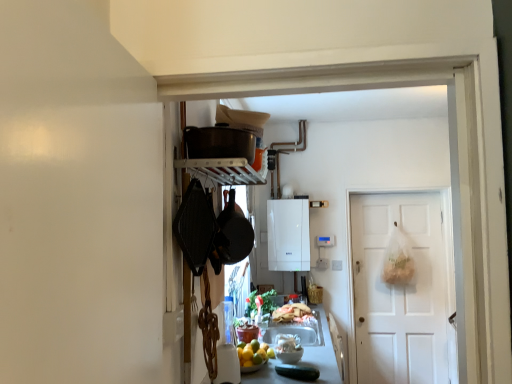
Locate an element on the screen. The height and width of the screenshot is (384, 512). smooth gray countertop at center is located at coordinates (312, 346).

In order to face smooth gray countertop at center, should I rotate leftwards or rightwards?

It's best to rotate right around 5.178 degrees.

Describe the element at coordinates (233, 233) in the screenshot. I see `black matte wok at center` at that location.

Find the location of a particular element. white matte door at center is located at coordinates (402, 291).

This screenshot has height=384, width=512. Describe the element at coordinates (288, 235) in the screenshot. I see `white glossy boiler at center, which is the first appliance in back-to-front order` at that location.

Where is `matte black pot at upper center, acting as the second appliance starting from the back`? This screenshot has height=384, width=512. matte black pot at upper center, acting as the second appliance starting from the back is located at coordinates pyautogui.click(x=219, y=142).

Between matte black pot at upper center, which appears as the first appliance when viewed from the top, and white glossy boiler at center, which is the 2th appliance from front to back, which one has less height?

matte black pot at upper center, which appears as the first appliance when viewed from the top.

Looking at this image, is matte black pot at upper center, arranged as the first appliance when viewed from the left, next to white glossy boiler at center, the first appliance positioned from the bottom, and touching it?

No, matte black pot at upper center, arranged as the first appliance when viewed from the left, is not beside white glossy boiler at center, the first appliance positioned from the bottom.

What are the coordinates of `appliance lying on the right of matte black pot at upper center, acting as the second appliance starting from the back` in the screenshot? It's located at (288, 235).

Between matte black pot at upper center, placed as the first appliance when sorted from front to back, and white glossy boiler at center, marked as the 2th appliance in a left-to-right arrangement, which one appears on the right side from the viewer's perspective?

white glossy boiler at center, marked as the 2th appliance in a left-to-right arrangement.

Is shiny plastic bag of bread at center, which is counted as the 2th food, starting from the front, facing away from black matte wok at center?

No, shiny plastic bag of bread at center, which is counted as the 2th food, starting from the front,'s orientation is not away from black matte wok at center.

From the black matte wok at center, count 2nd food to the right and point to it. Please provide its 2D coordinates.

[(292, 313)]

Considering the sizes of objects shiny plastic bag of bread at center, which is counted as the 2th food, starting from the front, and black matte wok at center in the image provided, who is thinner, shiny plastic bag of bread at center, which is counted as the 2th food, starting from the front, or black matte wok at center?

black matte wok at center.

Measure the distance between shiny plastic bag of bread at center, which is counted as the 2th food, starting from the front, and black matte wok at center.

The distance of shiny plastic bag of bread at center, which is counted as the 2th food, starting from the front, from black matte wok at center is 4.00 feet.

Considering their positions, is white glossy bowl at center, marked as the first food in a front-to-back arrangement, located in front of or behind matte black pot at upper center, the second appliance when ordered from right to left?

white glossy bowl at center, marked as the first food in a front-to-back arrangement, is behind matte black pot at upper center, the second appliance when ordered from right to left.

Is white glossy bowl at center, which is counted as the 2th food, starting from the back, oriented towards matte black pot at upper center, which appears as the first appliance when viewed from the top?

No, white glossy bowl at center, which is counted as the 2th food, starting from the back, is not oriented towards matte black pot at upper center, which appears as the first appliance when viewed from the top.

Are white glossy bowl at center, marked as the first food in a front-to-back arrangement, and matte black pot at upper center, which appears as the first appliance when viewed from the top, far apart?

Indeed, white glossy bowl at center, marked as the first food in a front-to-back arrangement, is not near matte black pot at upper center, which appears as the first appliance when viewed from the top.

Considering the relative sizes of white glossy bowl at center, which is counted as the 2th food, starting from the back, and matte black pot at upper center, the second appliance when ordered from right to left, in the image provided, is white glossy bowl at center, which is counted as the 2th food, starting from the back, smaller than matte black pot at upper center, the second appliance when ordered from right to left,?

Yes.

Is smooth gray countertop at center turned away from white glossy bowl at center, which is counted as the 2th food, starting from the back?

No, white glossy bowl at center, which is counted as the 2th food, starting from the back, is not at the back of smooth gray countertop at center.

Considering the relative positions of smooth gray countertop at center and white glossy bowl at center, which is counted as the 2th food, starting from the back, in the image provided, is smooth gray countertop at center to the right of white glossy bowl at center, which is counted as the 2th food, starting from the back, from the viewer's perspective?

Indeed, smooth gray countertop at center is positioned on the right side of white glossy bowl at center, which is counted as the 2th food, starting from the back.

Considering the relative positions of smooth gray countertop at center and white glossy bowl at center, marked as the first food in a front-to-back arrangement, in the image provided, is smooth gray countertop at center behind white glossy bowl at center, marked as the first food in a front-to-back arrangement,?

That is False.

Can you confirm if smooth gray countertop at center is thinner than white glossy bowl at center, which is counted as the 2th food, starting from the back?

No, smooth gray countertop at center is not thinner than white glossy bowl at center, which is counted as the 2th food, starting from the back.

Is black matte wok at center smaller than matte black pot at upper center, which appears as the first appliance when viewed from the top?

Actually, black matte wok at center might be larger than matte black pot at upper center, which appears as the first appliance when viewed from the top.

How many degrees apart are the facing directions of black matte wok at center and matte black pot at upper center, the 2th appliance in the bottom-to-top sequence?

black matte wok at center and matte black pot at upper center, the 2th appliance in the bottom-to-top sequence, are facing 0.000141 degrees away from each other.

Considering the sizes of objects black matte wok at center and matte black pot at upper center, placed as the first appliance when sorted from front to back, in the image provided, who is shorter, black matte wok at center or matte black pot at upper center, placed as the first appliance when sorted from front to back,?

With less height is matte black pot at upper center, placed as the first appliance when sorted from front to back.

Is black matte wok at center directly adjacent to matte black pot at upper center, the 2th appliance in the bottom-to-top sequence?

No.

What's the angular difference between white matte door at center and smooth gray countertop at center's facing directions?

They differ by 92.8 degrees in their facing directions.

Is white matte door at center taller than smooth gray countertop at center?

Yes, white matte door at center is taller than smooth gray countertop at center.

Is white matte door at center touching smooth gray countertop at center?

No, white matte door at center is not with smooth gray countertop at center.

From the image's perspective, is white matte door at center positioned above or below smooth gray countertop at center?

white matte door at center is situated higher than smooth gray countertop at center in the image.

Is black matte wok at center facing away from white glossy boiler at center, which is the 2th appliance from front to back?

No, black matte wok at center is not facing away from white glossy boiler at center, which is the 2th appliance from front to back.

Looking at this image, is black matte wok at center positioned far away from white glossy boiler at center, which is the first appliance in back-to-front order?

Indeed, black matte wok at center is not near white glossy boiler at center, which is the first appliance in back-to-front order.

Which of these two, black matte wok at center or white glossy boiler at center, the first appliance positioned from the right, is thinner?

Thinner between the two is black matte wok at center.

Is black matte wok at center behind white glossy boiler at center, the first appliance positioned from the bottom?

No, black matte wok at center is closer to the camera.

The width and height of the screenshot is (512, 384). Identify the location of appliance that appears above the white glossy boiler at center, which is the 2th appliance from front to back (from the image's perspective). (219, 142).

At what (x,y) coordinates should I click in order to perform the action: click on the 2nd food behind the black matte wok at center. Please return your answer as a coordinate pair (x, y). The image size is (512, 384). Looking at the image, I should click on (292, 313).

Which object lies nearer to the anchor point matte black pot at upper center, placed as the first appliance when sorted from front to back, white glossy boiler at center, the first appliance positioned from the right, or white matte door at center?

Based on the image, white glossy boiler at center, the first appliance positioned from the right, appears to be nearer to matte black pot at upper center, placed as the first appliance when sorted from front to back.

Based on their spatial positions, is matte black pot at upper center, arranged as the first appliance when viewed from the left, or shiny plastic bag of bread at center, which appears as the 1th food when viewed from the back, further from black matte wok at center?

shiny plastic bag of bread at center, which appears as the 1th food when viewed from the back, is further to black matte wok at center.

Considering their positions, is white glossy boiler at center, the first appliance positioned from the bottom, positioned closer to matte black pot at upper center, which appears as the first appliance when viewed from the top, than white glossy bowl at center, marked as the first food in a front-to-back arrangement?

Among the two, white glossy bowl at center, marked as the first food in a front-to-back arrangement, is located nearer to matte black pot at upper center, which appears as the first appliance when viewed from the top.

Looking at the image, which one is located closer to smooth gray countertop at center, white glossy boiler at center, the first appliance positioned from the right, or black matte wok at center?

black matte wok at center.

Considering their positions, is smooth gray countertop at center positioned closer to white matte door at center than white glossy boiler at center, which is the first appliance in back-to-front order?

Among the two, white glossy boiler at center, which is the first appliance in back-to-front order, is located nearer to white matte door at center.

Estimate the real-world distances between objects in this image. Which object is closer to white matte door at center, black matte wok at center or matte black pot at upper center, arranged as the first appliance when viewed from the left?

black matte wok at center lies closer to white matte door at center than the other object.

Looking at the image, which one is located closer to black matte wok at center, white glossy boiler at center, which is the first appliance in back-to-front order, or white matte door at center?

Based on the image, white glossy boiler at center, which is the first appliance in back-to-front order, appears to be nearer to black matte wok at center.

From the image, which object appears to be farther from black matte wok at center, white glossy bowl at center, marked as the first food in a front-to-back arrangement, or white glossy boiler at center, which is the first appliance in back-to-front order?

Among the two, white glossy boiler at center, which is the first appliance in back-to-front order, is located further to black matte wok at center.

Locate an element on the screen. counter top located between matte black pot at upper center, the 2th appliance in the bottom-to-top sequence, and white matte door at center in the depth direction is located at coordinates coord(312,346).

This screenshot has width=512, height=384. What are the coordinates of `appliance between smooth gray countertop at center and white matte door at center along the z-axis` in the screenshot? It's located at (288, 235).

The width and height of the screenshot is (512, 384). In order to click on food between white glossy bowl at center, marked as the first food in a front-to-back arrangement, and white matte door at center from front to back in this screenshot , I will do `click(292, 313)`.

Image resolution: width=512 pixels, height=384 pixels. Identify the location of counter top between matte black pot at upper center, placed as the first appliance when sorted from front to back, and shiny plastic bag of bread at center, which appears as the 1th food when viewed from the back, along the z-axis. (312, 346).